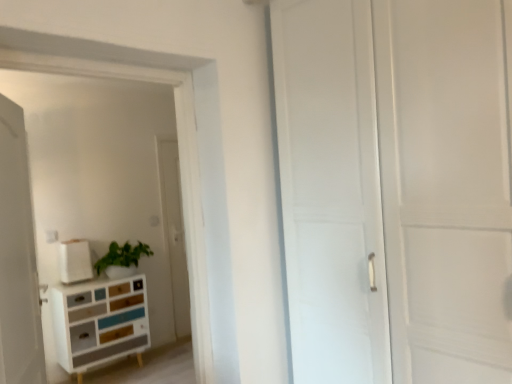
Question: From the image's perspective, is multicolored wood chest of drawers at lower left on top of white matte box at upper left?

Choices:
 (A) no
 (B) yes

Answer: (A)

Question: Can you confirm if multicolored wood chest of drawers at lower left is shorter than white matte box at upper left?

Choices:
 (A) no
 (B) yes

Answer: (A)

Question: Considering the relative sizes of multicolored wood chest of drawers at lower left and white matte box at upper left in the image provided, is multicolored wood chest of drawers at lower left wider than white matte box at upper left?

Choices:
 (A) yes
 (B) no

Answer: (A)

Question: Does multicolored wood chest of drawers at lower left have a greater height compared to white matte box at upper left?

Choices:
 (A) no
 (B) yes

Answer: (B)

Question: From a real-world perspective, is multicolored wood chest of drawers at lower left located beneath white matte box at upper left?

Choices:
 (A) yes
 (B) no

Answer: (A)

Question: Is multicolored wood chest of drawers at lower left positioned far away from white matte box at upper left?

Choices:
 (A) yes
 (B) no

Answer: (B)

Question: Does multicolored wood chest of drawers at lower left have a larger size compared to white matte door at left?

Choices:
 (A) no
 (B) yes

Answer: (B)

Question: Is multicolored wood chest of drawers at lower left completely or partially outside of white matte door at left?

Choices:
 (A) no
 (B) yes

Answer: (B)

Question: Is multicolored wood chest of drawers at lower left further to camera compared to white matte door at left?

Choices:
 (A) no
 (B) yes

Answer: (B)

Question: From a real-world perspective, is multicolored wood chest of drawers at lower left under white matte door at left?

Choices:
 (A) yes
 (B) no

Answer: (A)

Question: Is multicolored wood chest of drawers at lower left at the right side of white matte door at left?

Choices:
 (A) no
 (B) yes

Answer: (A)

Question: Does multicolored wood chest of drawers at lower left have a greater height compared to white matte door at left?

Choices:
 (A) yes
 (B) no

Answer: (B)

Question: Is white matte box at upper left positioned before multicolored wood chest of drawers at lower left?

Choices:
 (A) no
 (B) yes

Answer: (A)